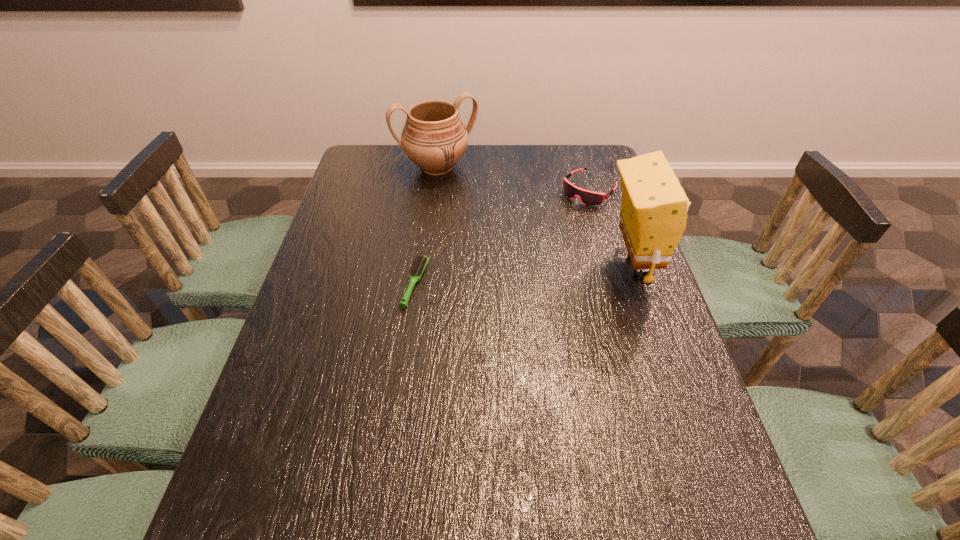
Identify the location of free space on the desktop that is between the hairbrush and the sponge and is positioned on the front-facing side of the second tallest object. (500, 276).

Where is `free space on the desktop that is between the shortest object and the tallest object and is positioned on the front-facing side of the goggles`? This screenshot has width=960, height=540. free space on the desktop that is between the shortest object and the tallest object and is positioned on the front-facing side of the goggles is located at coordinates (498, 277).